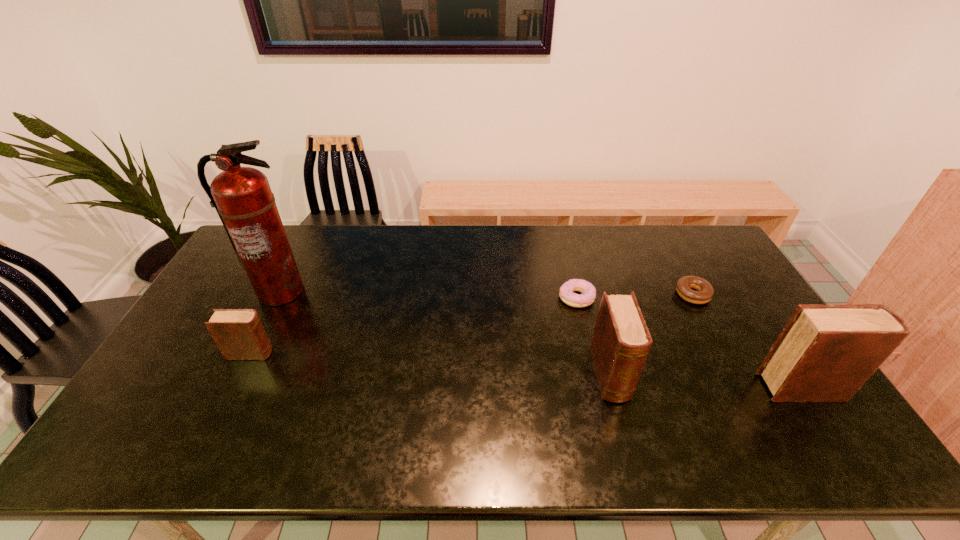
Please point a location where one more diary can be added evenly. Please provide its 2D coordinates. Your answer should be formatted as a tuple, i.e. [(x, y)], where the tuple contains the x and y coordinates of a point satisfying the conditions above.

[(426, 364)]